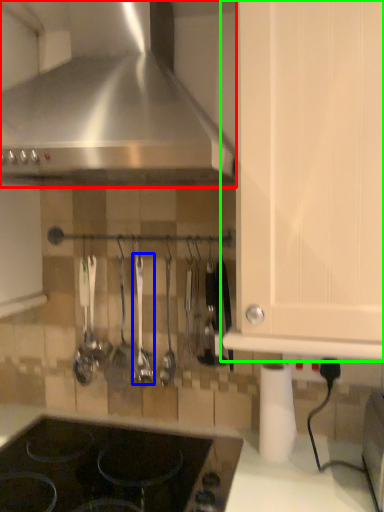
Question: Which is farther away from kitchen appliance (highlighted by a red box)? silverware (highlighted by a blue box) or cabinetry (highlighted by a green box)?

Choices:
 (A) silverware
 (B) cabinetry

Answer: (A)